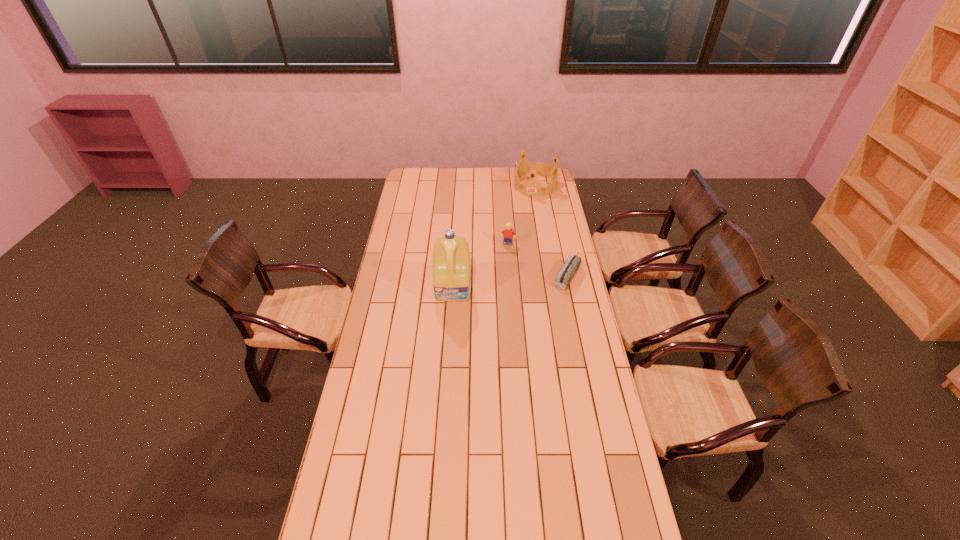
In the image, there is a desktop. Where is `free region at the near edge`? This screenshot has height=540, width=960. free region at the near edge is located at coordinates (428, 530).

You are a GUI agent. You are given a task and a screenshot of the screen. Output one action in this format:
    pyautogui.click(x=<x>, y=<y>)
    Task: Click on the free space at the left edge of the desktop
    The width and height of the screenshot is (960, 540).
    Given the screenshot: What is the action you would take?
    pyautogui.click(x=397, y=336)

The width and height of the screenshot is (960, 540). Identify the location of free space at the right edge of the desktop. (564, 322).

Where is `free region at the near left corner`? This screenshot has width=960, height=540. free region at the near left corner is located at coordinates (356, 523).

In the image, there is a desktop. Identify the location of vacant area at the near right corner. (607, 505).

This screenshot has width=960, height=540. I want to click on empty space that is in between the detergent and the second shortest object, so click(x=481, y=266).

The image size is (960, 540). In order to click on free space that is in between the detergent and the second shortest object in this screenshot , I will do `click(481, 266)`.

The image size is (960, 540). Identify the location of vacant area that lies between the detergent and the Lego. (481, 266).

Where is `free space that is in between the second shortest object and the shortest object`? free space that is in between the second shortest object and the shortest object is located at coordinates (538, 259).

I want to click on free space that is in between the Lego and the tallest object, so click(481, 266).